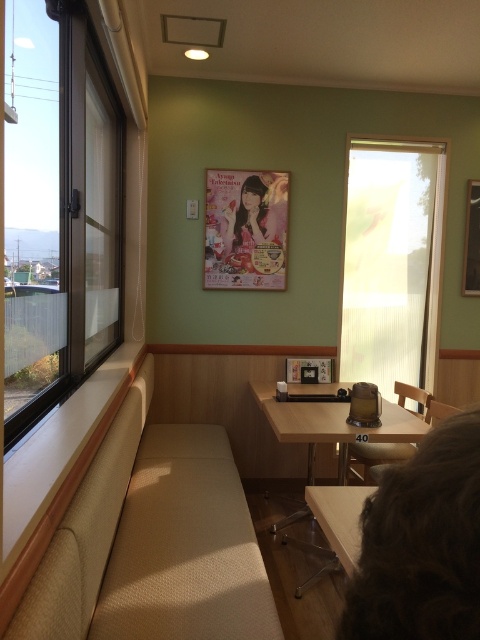
Question: Which of the following is the closest to the observer?

Choices:
 (A) translucent glass window at center
 (B) matte pink poster at center
 (C) wooden table at center

Answer: (C)

Question: Among these points, which one is nearest to the camera?

Choices:
 (A) (406, 387)
 (B) (393, 228)

Answer: (A)

Question: Does dark brown fur at lower right appear on the left side of wooden chair at center?

Choices:
 (A) no
 (B) yes

Answer: (B)

Question: Does beige fabric bench at lower left have a greater width compared to transparent glass window at left?

Choices:
 (A) no
 (B) yes

Answer: (B)

Question: Does wooden table at center have a smaller size compared to matte pink poster at center?

Choices:
 (A) no
 (B) yes

Answer: (A)

Question: Which of the following is the farthest from the observer?

Choices:
 (A) wooden chair at center
 (B) transparent glass window at left
 (C) dark brown fur at lower right

Answer: (A)